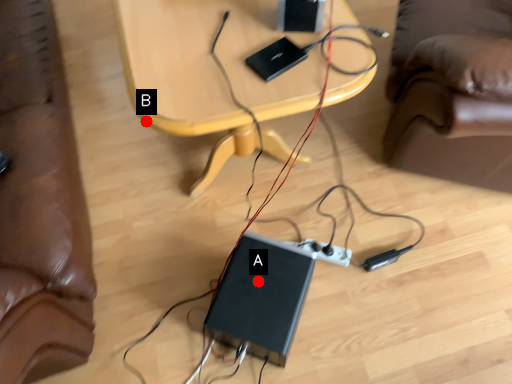
Question: Two points are circled on the image, labeled by A and B beside each circle. Which of the following is the closest to the observer?

Choices:
 (A) A is closer
 (B) B is closer

Answer: (B)